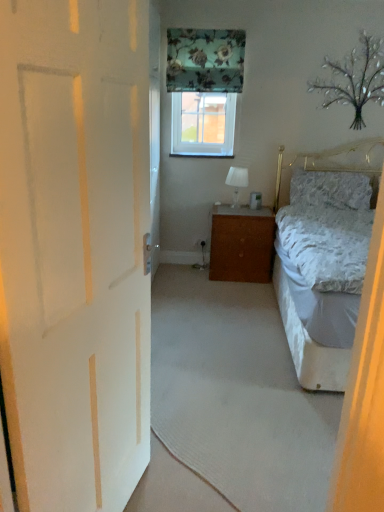
Question: From the image's perspective, is white matte door at left beneath fluffy white pillow at right?

Choices:
 (A) yes
 (B) no

Answer: (A)

Question: Can you confirm if white matte door at left is shorter than fluffy white pillow at right?

Choices:
 (A) no
 (B) yes

Answer: (A)

Question: Can you confirm if white matte door at left is positioned to the left of fluffy white pillow at right?

Choices:
 (A) yes
 (B) no

Answer: (A)

Question: Does white matte door at left lie in front of fluffy white pillow at right?

Choices:
 (A) yes
 (B) no

Answer: (A)

Question: From the image's perspective, would you say white matte door at left is positioned over fluffy white pillow at right?

Choices:
 (A) yes
 (B) no

Answer: (B)

Question: From a real-world perspective, is fluffy white pillow at right positioned above or below clear glass window at center?

Choices:
 (A) below
 (B) above

Answer: (A)

Question: Does point (347, 197) appear closer or farther from the camera than point (213, 153)?

Choices:
 (A) closer
 (B) farther

Answer: (A)

Question: Considering the positions of fluffy white pillow at right and clear glass window at center in the image, is fluffy white pillow at right wider or thinner than clear glass window at center?

Choices:
 (A) wide
 (B) thin

Answer: (A)

Question: From their relative heights in the image, would you say fluffy white pillow at right is taller or shorter than clear glass window at center?

Choices:
 (A) tall
 (B) short

Answer: (B)

Question: From the image's perspective, is brown wood cabinet at center located above or below white fabric lampshade at center?

Choices:
 (A) below
 (B) above

Answer: (A)

Question: From a real-world perspective, is brown wood cabinet at center positioned above or below white fabric lampshade at center?

Choices:
 (A) below
 (B) above

Answer: (A)

Question: Does point 243,234 appear closer or farther from the camera than point 231,177?

Choices:
 (A) closer
 (B) farther

Answer: (A)

Question: Visually, is brown wood cabinet at center positioned to the left or to the right of white fabric lampshade at center?

Choices:
 (A) left
 (B) right

Answer: (B)

Question: Considering the positions of white carpet at center and white fabric lampshade at center in the image, is white carpet at center wider or thinner than white fabric lampshade at center?

Choices:
 (A) wide
 (B) thin

Answer: (A)

Question: Based on their positions, is white carpet at center located to the left or right of white fabric lampshade at center?

Choices:
 (A) right
 (B) left

Answer: (A)